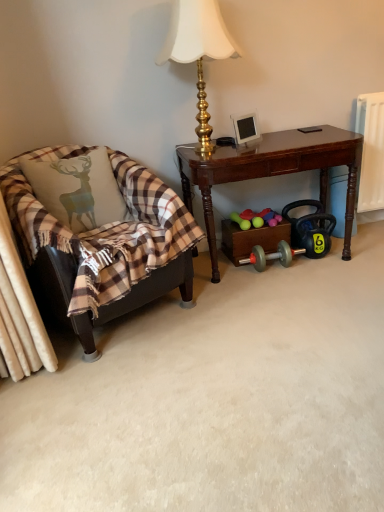
Question: Looking at their shapes, would you say gold metallic lamp at upper center is wider or thinner than plaid fabric chair at left?

Choices:
 (A) wide
 (B) thin

Answer: (B)

Question: From the image's perspective, is gold metallic lamp at upper center above or below plaid fabric chair at left?

Choices:
 (A) above
 (B) below

Answer: (A)

Question: Estimate the real-world distances between objects in this image. Which object is closer to the gold metallic lamp at upper center?

Choices:
 (A) dark wood desk at center
 (B) plaid fabric chair at left
 (C) plaid fabric pillow at left

Answer: (A)

Question: Considering the real-world distances, which object is closest to the plaid fabric pillow at left?

Choices:
 (A) gold metallic lamp at upper center
 (B) plaid fabric chair at left
 (C) dark wood desk at center

Answer: (B)